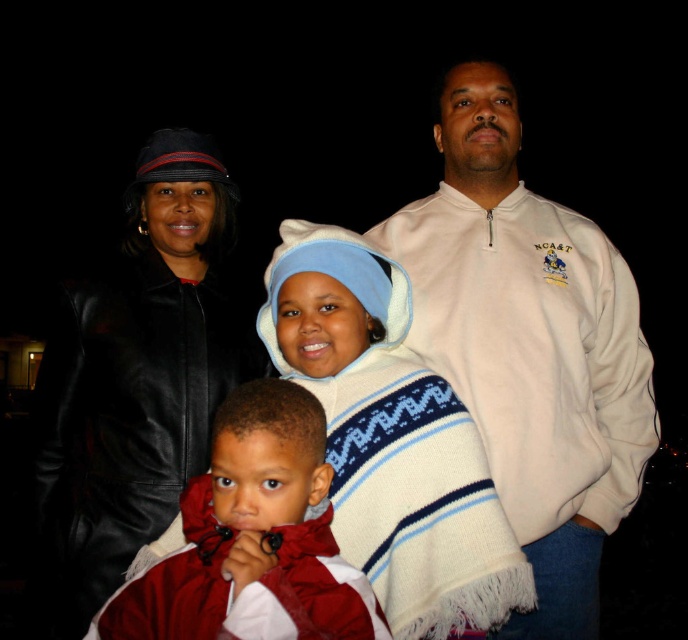
Question: Which is farther from the white knitted sweater at center?

Choices:
 (A) black leather jacket at upper left
 (B) red fleece jacket at center

Answer: (A)

Question: Which point is closer to the camera taking this photo?

Choices:
 (A) (96, 481)
 (B) (272, 289)
 (C) (516, 372)

Answer: (B)

Question: Does white knitted sweater at center appear over red fleece jacket at center?

Choices:
 (A) yes
 (B) no

Answer: (A)

Question: From the image, what is the correct spatial relationship of black leather jacket at upper left in relation to white knitted sweater at center?

Choices:
 (A) right
 (B) left

Answer: (B)

Question: Does black leather jacket at upper left have a smaller size compared to red fleece jacket at center?

Choices:
 (A) yes
 (B) no

Answer: (B)

Question: Which of the following is the closest to the observer?

Choices:
 (A) (312, 266)
 (B) (594, 451)
 (C) (241, 483)
 (D) (139, 490)

Answer: (C)